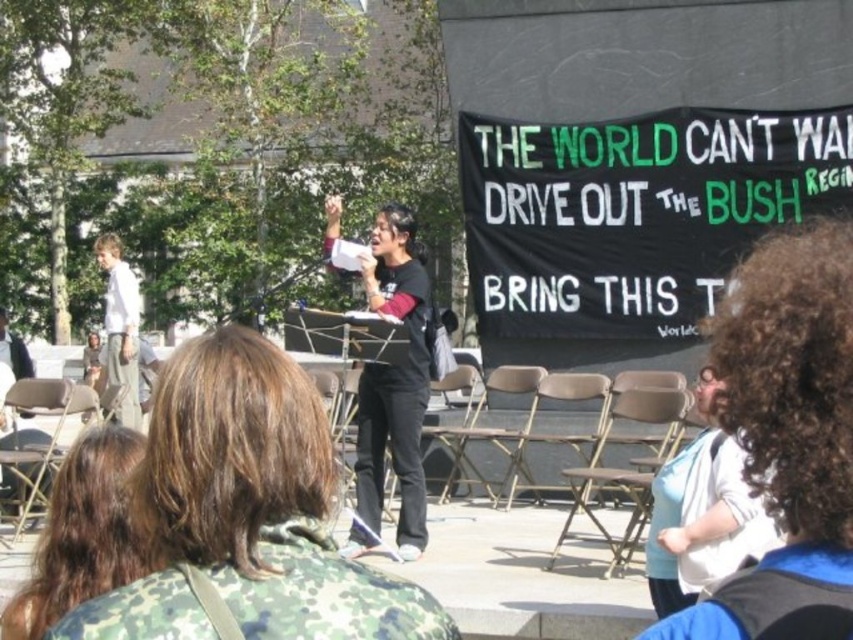
Question: From the image, what is the correct spatial relationship of black matte shirt at center in relation to camouflage jacket at center?

Choices:
 (A) below
 (B) above

Answer: (B)

Question: Which object is closer to the camera taking this photo?

Choices:
 (A) black matte shirt at center
 (B) white cotton shirt at left

Answer: (A)

Question: Which of the following is the farthest from the observer?

Choices:
 (A) (131, 304)
 (B) (688, 604)
 (C) (59, 552)

Answer: (A)

Question: Estimate the real-world distances between objects in this image. Which object is closer to the white cotton shirt at left?

Choices:
 (A) dark brown hair at center
 (B) camouflage jacket at center
 (C) light blue fabric shirt at lower right

Answer: (C)

Question: In this image, where is camouflage jacket at center located relative to white cotton shirt at left?

Choices:
 (A) right
 (B) left

Answer: (A)

Question: Does light blue shirt at center have a lesser width compared to black matte shirt at center?

Choices:
 (A) yes
 (B) no

Answer: (B)